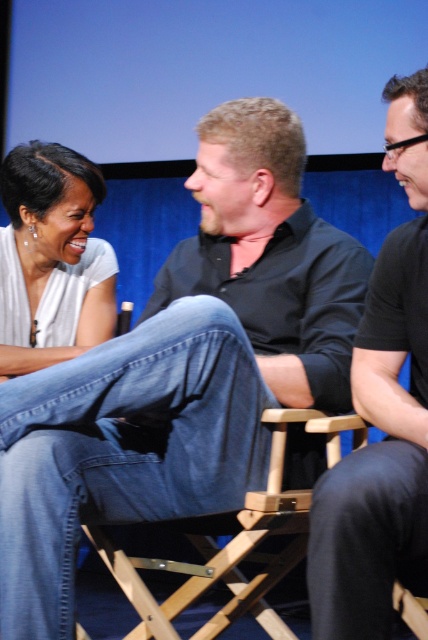
Does point (347, 561) lie behind point (323, 420)?

No, (347, 561) is closer to viewer.

Does black matte shirt at center appear on the left side of wooden director's chair at center?

No, black matte shirt at center is not to the left of wooden director's chair at center.

The width and height of the screenshot is (428, 640). What do you see at coordinates (382, 412) in the screenshot?
I see `black matte shirt at center` at bounding box center [382, 412].

The width and height of the screenshot is (428, 640). Find the location of `black matte shirt at center`. black matte shirt at center is located at coordinates (382, 412).

Is point (397, 166) positioned behind point (3, 179)?

No, it is in front of (3, 179).

From the picture: How much distance is there between black matte shirt at center and white matte shirt at upper left?

black matte shirt at center is 93.35 centimeters away from white matte shirt at upper left.

Does point (369, 342) come behind point (3, 326)?

No, (369, 342) is in front of (3, 326).

Locate an element on the screen. black matte shirt at center is located at coordinates (382, 412).

Image resolution: width=428 pixels, height=640 pixels. What do you see at coordinates (51, 253) in the screenshot?
I see `white matte shirt at upper left` at bounding box center [51, 253].

Is point (14, 369) behind point (276, 509)?

Yes.

You are a GUI agent. You are given a task and a screenshot of the screen. Output one action in this format:
    pyautogui.click(x=<x>, y=<y>)
    Task: Click on the white matte shirt at upper left
    This screenshot has height=640, width=428.
    Given the screenshot: What is the action you would take?
    pyautogui.click(x=51, y=253)

Identify the location of white matte shirt at upper left. This screenshot has width=428, height=640. (51, 253).